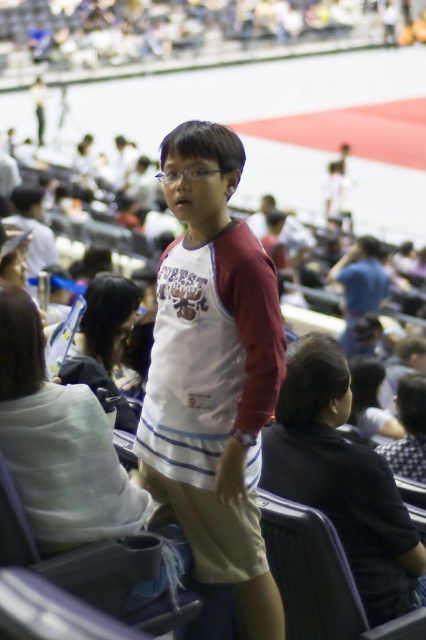
Which is in front, point (307, 497) or point (389, 445)?

Point (307, 497)

Is black fabric shirt at center wider than checkered fabric headscarf at center?

Correct, the width of black fabric shirt at center exceeds that of checkered fabric headscarf at center.

Describe the element at coordinates (342, 477) in the screenshot. The width and height of the screenshot is (426, 640). I see `black fabric shirt at center` at that location.

The width and height of the screenshot is (426, 640). I want to click on black fabric shirt at center, so click(x=342, y=477).

Is white cotton shirt at center further to the viewer compared to checkered fabric headscarf at center?

No, it is in front of checkered fabric headscarf at center.

Between point (249, 508) and point (412, 406), which one is positioned behind?

The point (412, 406) is more distant.

Locate an element on the screen. white cotton shirt at center is located at coordinates (213, 372).

Who is higher up, white cotton shirt at center or black fabric shirt at center?

white cotton shirt at center

Does white cotton shirt at center have a lesser width compared to black fabric shirt at center?

Yes, white cotton shirt at center is thinner than black fabric shirt at center.

The image size is (426, 640). I want to click on white cotton shirt at center, so click(x=213, y=372).